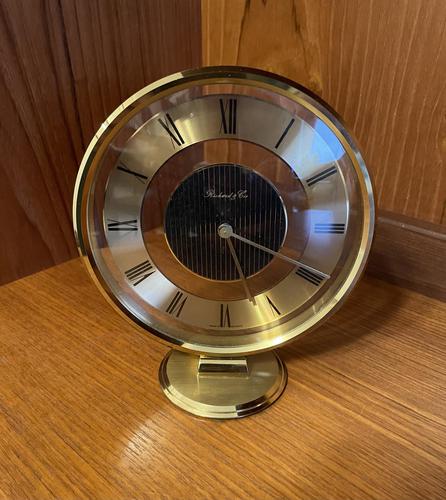
The width and height of the screenshot is (446, 500). I want to click on outer edge of the clock, so click(x=202, y=71).